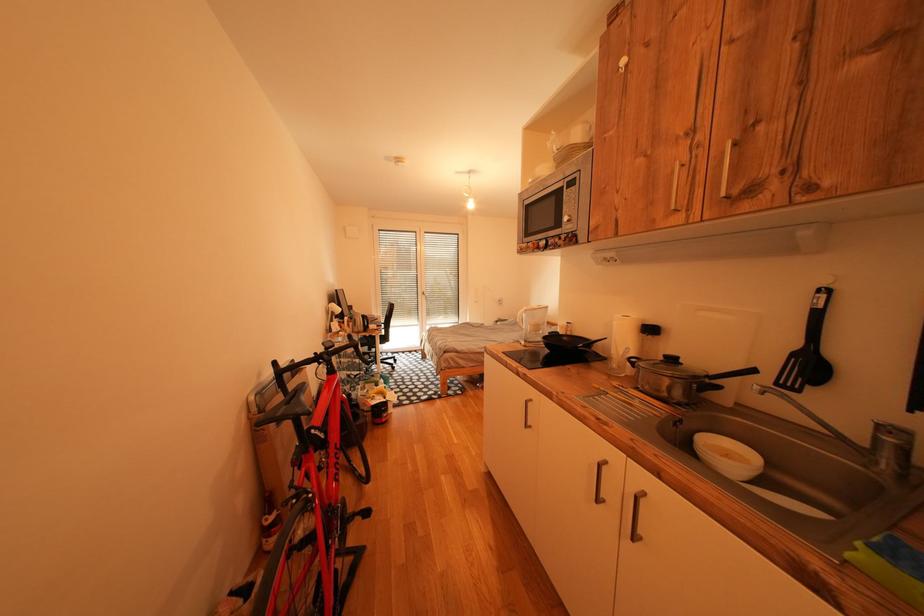
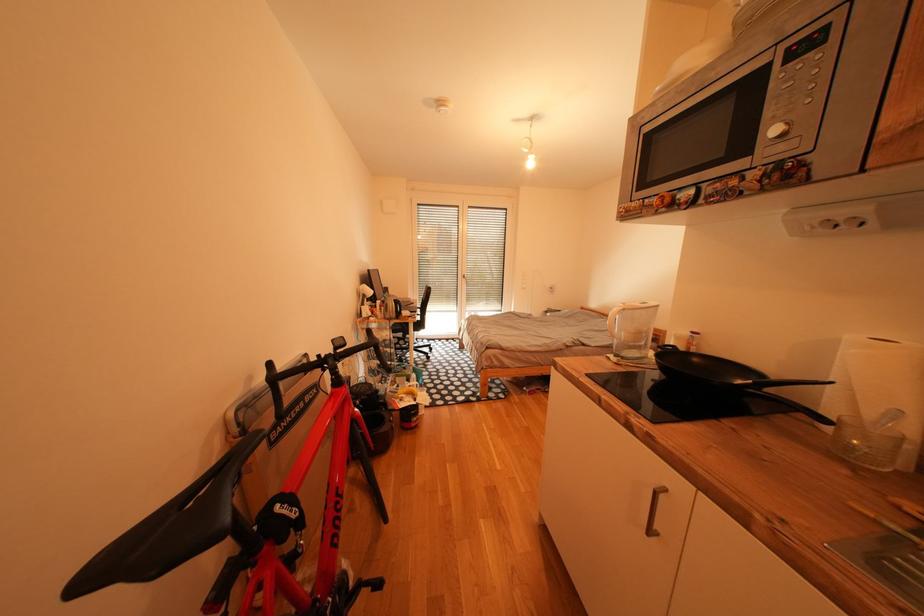
Question: The first image is from the beginning of the video and the second image is from the end. How did the camera likely rotate when shooting the video?

Choices:
 (A) Left
 (B) Right
 (C) Up
 (D) Down

Answer: (A)